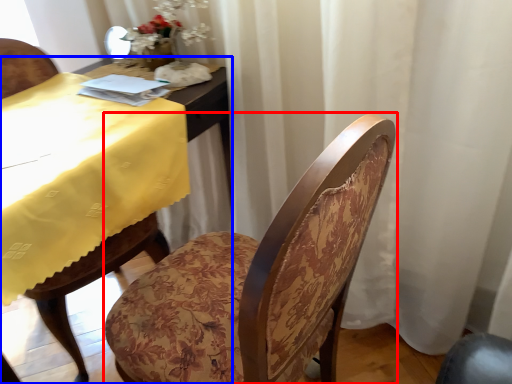
Question: Among these objects, which one is farthest to the camera, chair (highlighted by a red box) or table (highlighted by a blue box)?

Choices:
 (A) chair
 (B) table

Answer: (B)